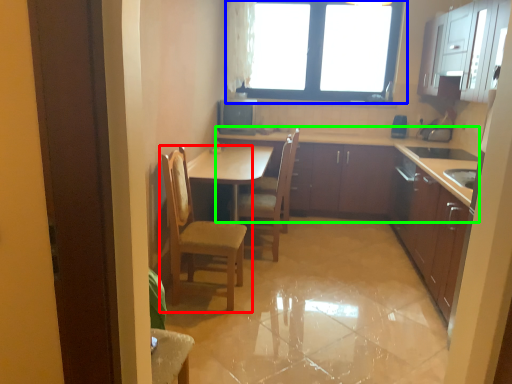
Question: Estimate the real-world distances between objects in this image. Which object is farther from chair (highlighted by a red box), window (highlighted by a blue box) or cabinetry (highlighted by a green box)?

Choices:
 (A) window
 (B) cabinetry

Answer: (A)